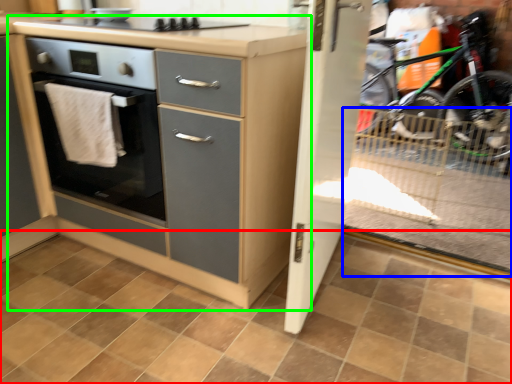
Question: Which object is positioned farthest from ceramic tile (highlighted by a red box)? Select from glass door (highlighted by a blue box) and chest of drawers (highlighted by a green box).

Choices:
 (A) glass door
 (B) chest of drawers

Answer: (A)